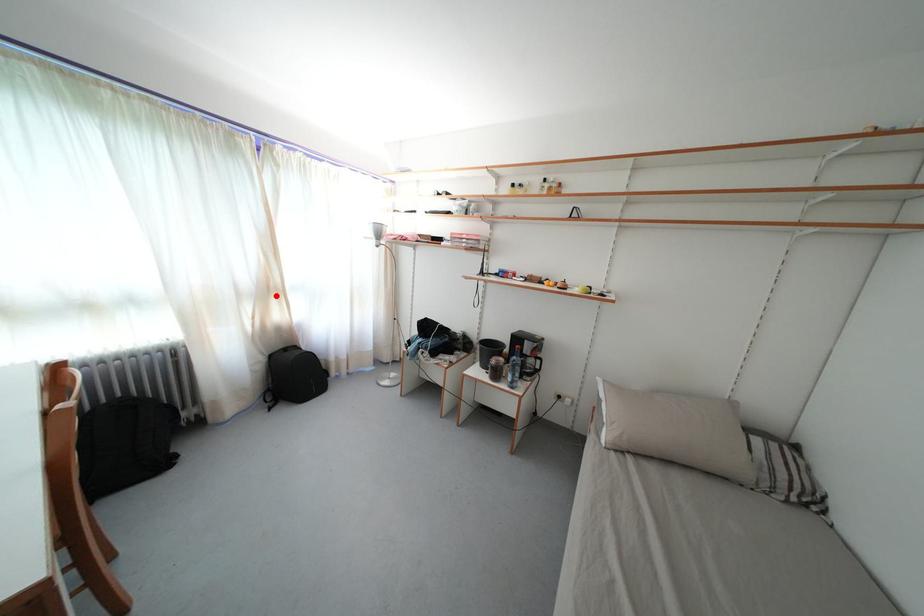
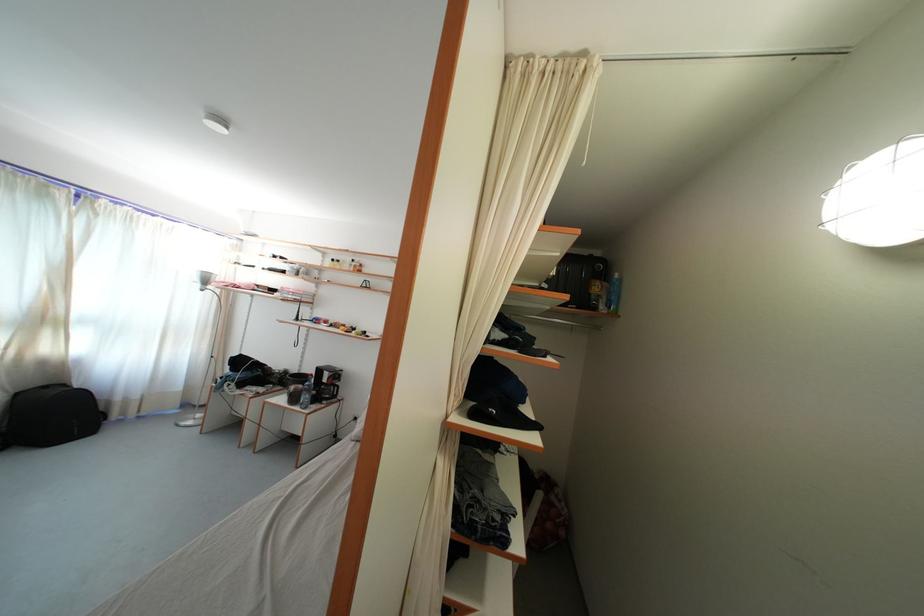
Where in the second image is the point corresponding to the highlighted location from the first image?

(52, 326)